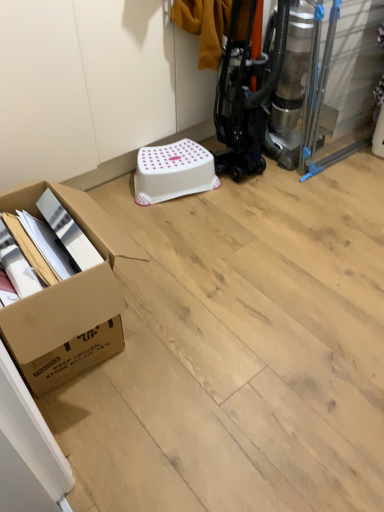
You are a GUI agent. You are given a task and a screenshot of the screen. Output one action in this format:
    pyautogui.click(x=<x>, y=<y>)
    Task: Click on the blank space above white plastic stool at center (from a real-world perspective)
    This screenshot has width=384, height=512.
    Given the screenshot: What is the action you would take?
    pyautogui.click(x=171, y=154)